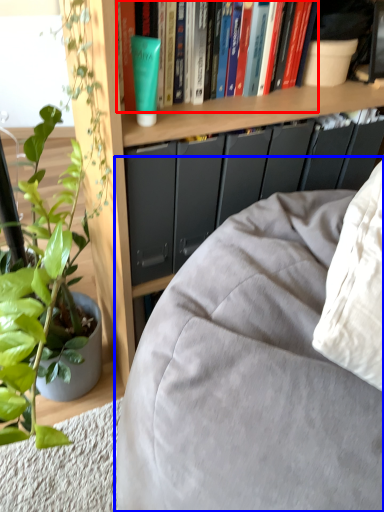
Question: Which of the following is the closest to the observer, book (highlighted by a red box) or studio couch (highlighted by a blue box)?

Choices:
 (A) book
 (B) studio couch

Answer: (B)